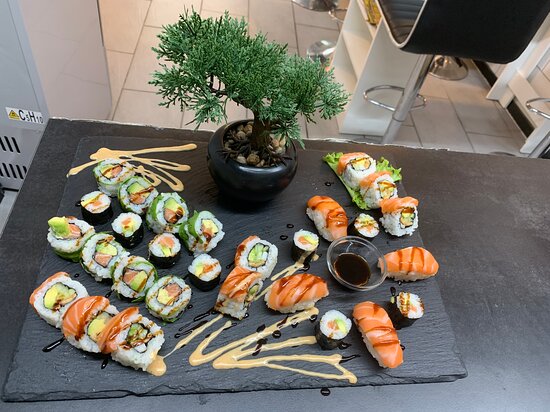
Locate an element on the screen. The width and height of the screenshot is (550, 412). floor is located at coordinates (286, 30).